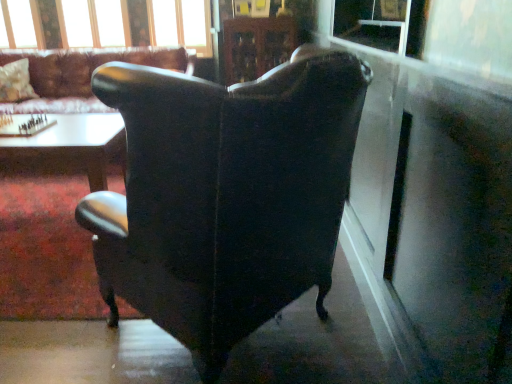
Question: Is white glossy table at lower left, placed as the second table when sorted from top to bottom, aimed at transparent plastic window screen at upper right?

Choices:
 (A) no
 (B) yes

Answer: (A)

Question: Does white glossy table at lower left, which is the 1th table from bottom to top, have a lesser width compared to transparent plastic window screen at upper right?

Choices:
 (A) no
 (B) yes

Answer: (A)

Question: Are white glossy table at lower left, placed as the second table when sorted from top to bottom, and transparent plastic window screen at upper right beside each other?

Choices:
 (A) no
 (B) yes

Answer: (A)

Question: Considering the relative sizes of white glossy table at lower left, placed as the second table when sorted from top to bottom, and transparent plastic window screen at upper right in the image provided, is white glossy table at lower left, placed as the second table when sorted from top to bottom, bigger than transparent plastic window screen at upper right?

Choices:
 (A) yes
 (B) no

Answer: (A)

Question: Is white glossy table at lower left, which is the 1th table from bottom to top, further to the viewer compared to transparent plastic window screen at upper right?

Choices:
 (A) no
 (B) yes

Answer: (B)

Question: Does white glossy table at lower left, placed as the second table when sorted from top to bottom, appear on the right side of transparent plastic window screen at upper right?

Choices:
 (A) no
 (B) yes

Answer: (A)

Question: Does matte black wingback chair at center, which is the first chair from top to bottom, touch transparent plastic window screen at upper right?

Choices:
 (A) no
 (B) yes

Answer: (A)

Question: Considering the relative positions of matte black wingback chair at center, which is the first chair from top to bottom, and transparent plastic window screen at upper right in the image provided, is matte black wingback chair at center, which is the first chair from top to bottom, to the left of transparent plastic window screen at upper right from the viewer's perspective?

Choices:
 (A) no
 (B) yes

Answer: (B)

Question: From the image's perspective, is matte black wingback chair at center, arranged as the 1th chair when viewed from the left, on transparent plastic window screen at upper right?

Choices:
 (A) yes
 (B) no

Answer: (A)

Question: Does matte black wingback chair at center, the 1th chair from the back, lie in front of transparent plastic window screen at upper right?

Choices:
 (A) yes
 (B) no

Answer: (B)

Question: Is matte black wingback chair at center, which is the second chair in bottom-to-top order, aimed at transparent plastic window screen at upper right?

Choices:
 (A) no
 (B) yes

Answer: (A)

Question: Are matte black wingback chair at center, which is the second chair in bottom-to-top order, and transparent plastic window screen at upper right far apart?

Choices:
 (A) yes
 (B) no

Answer: (A)

Question: From a real-world perspective, is clear glass window frame at upper center under transparent plastic window screen at upper right?

Choices:
 (A) yes
 (B) no

Answer: (A)